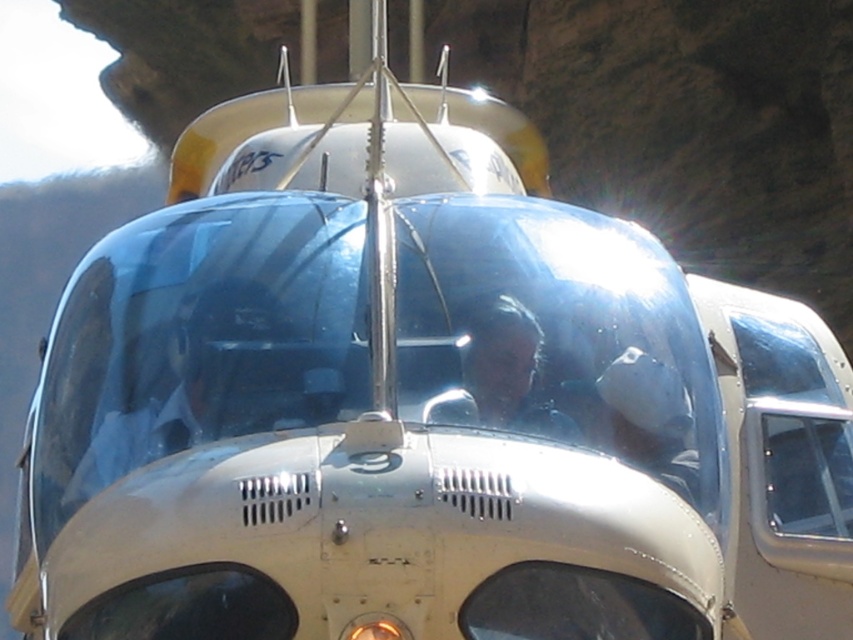
Question: Does transparent plastic pilot at center appear on the right side of matte black helmet at center?

Choices:
 (A) no
 (B) yes

Answer: (A)

Question: Among these objects, which one is farthest from the camera?

Choices:
 (A) matte black helmet at center
 (B) transparent plastic pilot at center

Answer: (A)

Question: Is transparent plastic pilot at center positioned behind matte black helmet at center?

Choices:
 (A) yes
 (B) no

Answer: (B)

Question: Is transparent plastic pilot at center smaller than matte black helmet at center?

Choices:
 (A) no
 (B) yes

Answer: (A)

Question: Which object appears farthest from the camera in this image?

Choices:
 (A) transparent plastic pilot at center
 (B) matte black helmet at center

Answer: (B)